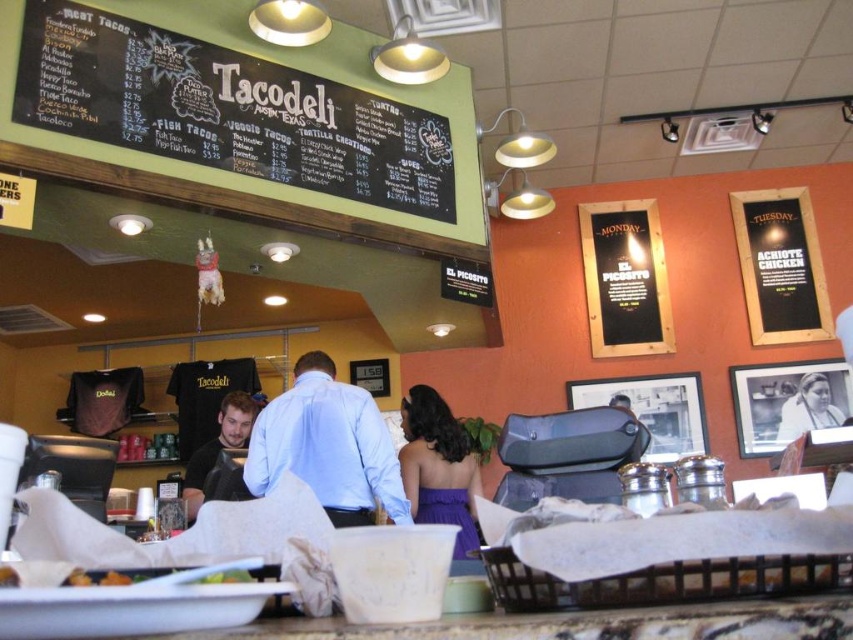
You are a customer waiting in line at the Tacodeli counter and notice two shirts displayed at the center of the menu board area. The light blue shirt at center and the matte black shirt at center. Which shirt is more visible to you?

The light blue shirt at center is more visible because it is in front of the matte black shirt at center.

You are a customer entering the Tacodeli restaurant and notice the black chalkboard menu at upper center and the purple satin dress at center. Which object is positioned higher up in the image?

The black chalkboard menu at upper center is positioned higher up in the image than the purple satin dress at center.

Looking at this image, you are a customer at Tacodeli in Austin and you want to see both the light blue shirt at center and the matte black shirt at center. Since you are of average height, which one do you need to look up to see?

The light blue shirt at center is much taller than the matte black shirt at center, so you need to look up to see the light blue shirt at center.